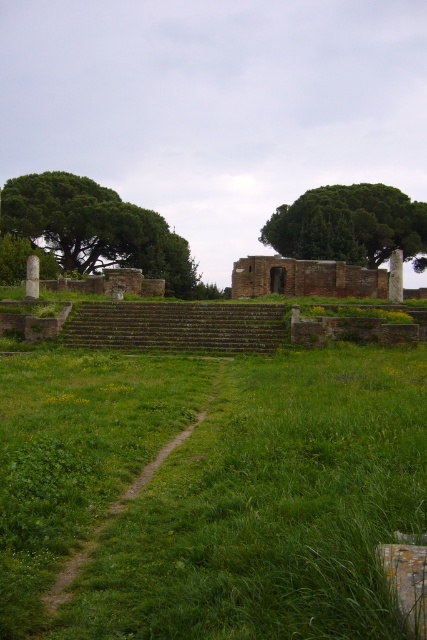
Can you confirm if green leafy tree at left is positioned to the left of green grassy path at center?

Yes, green leafy tree at left is to the left of green grassy path at center.

Can you confirm if green leafy tree at left is smaller than green grassy path at center?

No.

Identify the location of green leafy tree at left. (96, 228).

Based on the photo, between green grassy field at center and green grassy path at center, which one appears on the right side from the viewer's perspective?

green grassy field at center is more to the right.

Can you confirm if green grassy field at center is positioned to the right of green grassy path at center?

Indeed, green grassy field at center is positioned on the right side of green grassy path at center.

Is point (81, 467) closer to viewer compared to point (175, 442)?

Yes.

You are a GUI agent. You are given a task and a screenshot of the screen. Output one action in this format:
    pyautogui.click(x=<x>, y=<y>)
    Task: Click on the green grassy field at center
    This screenshot has width=427, height=640.
    Given the screenshot: What is the action you would take?
    pyautogui.click(x=271, y=508)

Does green grassy field at center have a smaller size compared to green leafy tree at left?

Yes.

Measure the distance between green grassy field at center and camera.

green grassy field at center and camera are 3.71 meters apart.

Identify the location of green grassy field at center. (271, 508).